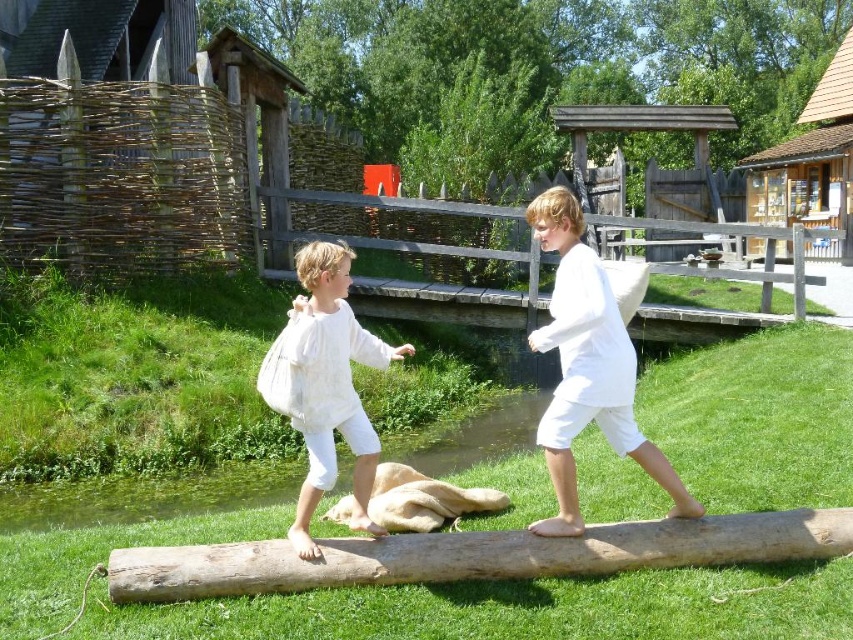
You are a photographer trying to capture the children walking on the log. You notice two points marked on your viewfinder at coordinates point (564,410) and point (440,428). Which point is closer to the camera?

A: Point (564,410) is closer to the camera than point (440,428).